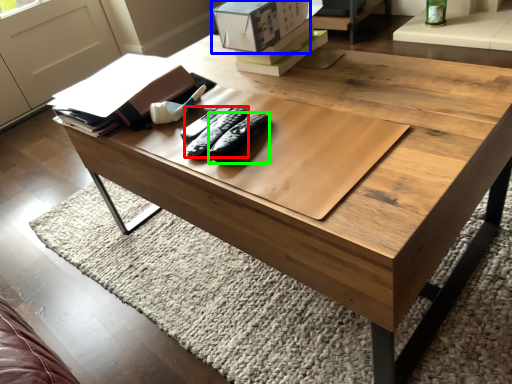
Question: Which is nearer to the remote (highlighted by a red box)? cardboard box (highlighted by a blue box) or remote (highlighted by a green box).

Choices:
 (A) cardboard box
 (B) remote

Answer: (B)